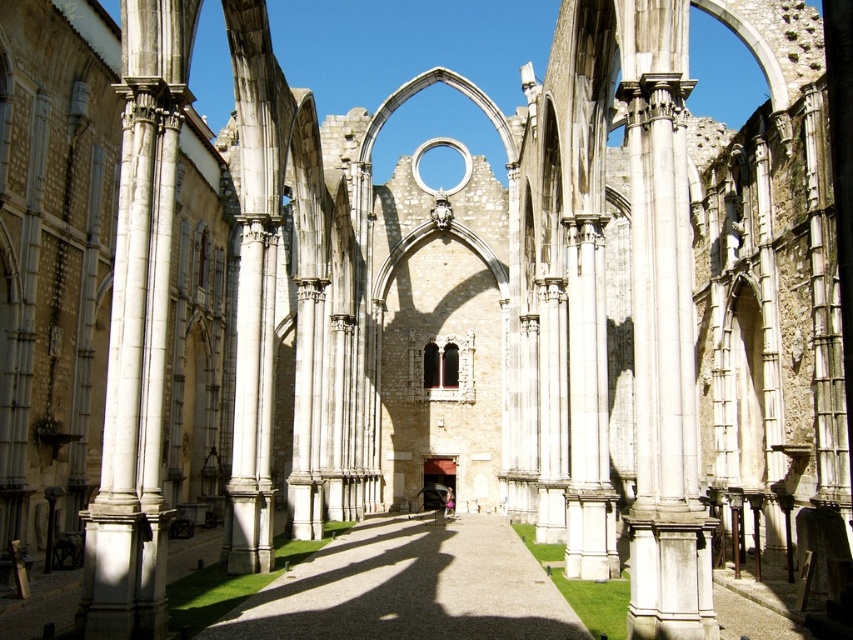
Question: Does white marble column at left have a greater width compared to gravel pathway at center?

Choices:
 (A) yes
 (B) no

Answer: (B)

Question: Is white marble column at left to the left of gravel pathway at center from the viewer's perspective?

Choices:
 (A) yes
 (B) no

Answer: (A)

Question: Which object is closer to the camera taking this photo?

Choices:
 (A) white marble column at left
 (B) gravel pathway at center

Answer: (A)

Question: Does white marble column at left have a larger size compared to gravel pathway at center?

Choices:
 (A) yes
 (B) no

Answer: (A)

Question: Which of the following is the closest to the observer?

Choices:
 (A) gravel pathway at center
 (B) white marble column at left

Answer: (B)

Question: Which point is closer to the camera taking this photo?

Choices:
 (A) (138, 420)
 (B) (340, 620)

Answer: (A)